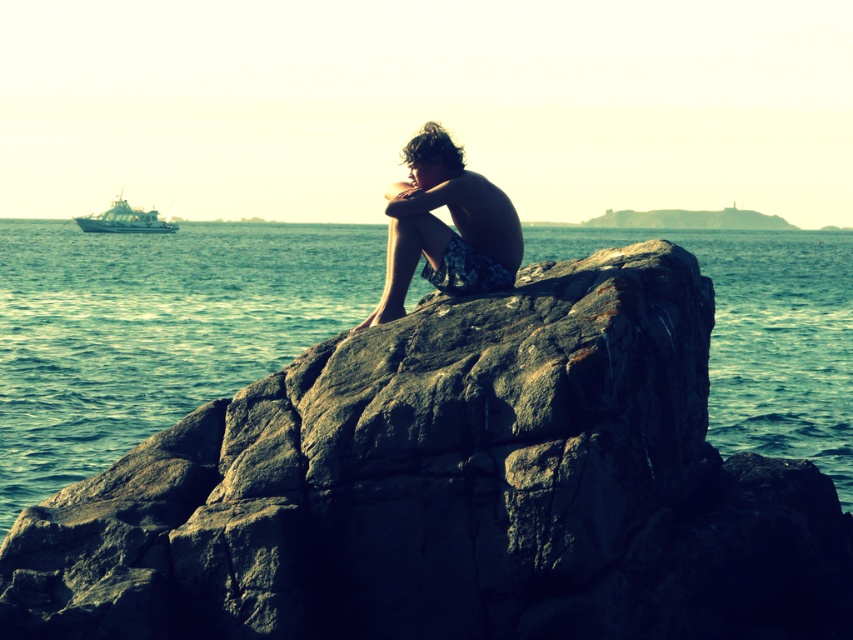
Question: Among these objects, which one is nearest to the camera?

Choices:
 (A) blue water at center
 (B) floral shorts at center

Answer: (A)

Question: Among these points, which one is nearest to the camera?

Choices:
 (A) (770, 396)
 (B) (143, 227)

Answer: (A)

Question: Is blue water at center further to camera compared to white matte boat at left?

Choices:
 (A) no
 (B) yes

Answer: (A)

Question: Which point is farther to the camera?

Choices:
 (A) floral shorts at center
 (B) blue water at center

Answer: (A)

Question: Observing the image, what is the correct spatial positioning of floral shorts at center in reference to white matte boat at left?

Choices:
 (A) above
 (B) below

Answer: (B)

Question: Is floral shorts at center above white matte boat at left?

Choices:
 (A) no
 (B) yes

Answer: (A)